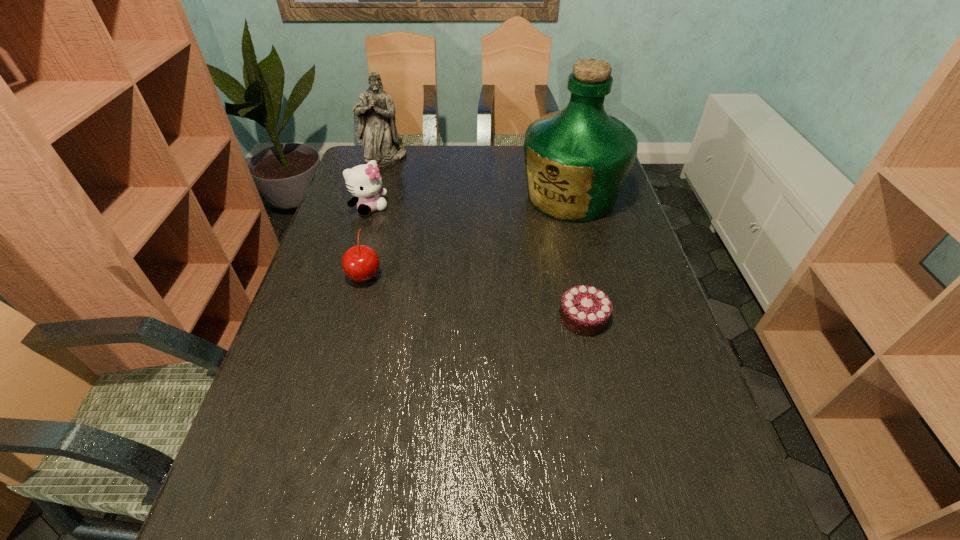
Locate an element on the screen. The height and width of the screenshot is (540, 960). vacant area that lies between the fourth shortest object and the fourth farthest object is located at coordinates (375, 216).

In order to click on free space between the liquor and the figurine in this screenshot , I will do `click(478, 177)`.

The height and width of the screenshot is (540, 960). I want to click on vacant area that lies between the cherry and the farthest object, so click(x=375, y=216).

In order to click on object identified as the third closest to the third tallest object in this screenshot , I will do `click(577, 160)`.

Locate which object is the closest to the chocolate cake. Please provide its 2D coordinates. Your answer should be formatted as a tuple, i.e. [(x, y)], where the tuple contains the x and y coordinates of a point satisfying the conditions above.

[(577, 160)]

Where is `free space that satisfies the following two spatial constraints: 1. on the back side of the tallest object; 2. on the left side of the third tallest object`? The height and width of the screenshot is (540, 960). free space that satisfies the following two spatial constraints: 1. on the back side of the tallest object; 2. on the left side of the third tallest object is located at coordinates (x=372, y=197).

The image size is (960, 540). In order to click on vacant space that satisfies the following two spatial constraints: 1. on the front side of the figurine; 2. on the right side of the liquor in this screenshot , I will do `click(373, 197)`.

Locate an element on the screen. The width and height of the screenshot is (960, 540). vacant area in the image that satisfies the following two spatial constraints: 1. on the front side of the second shortest object; 2. on the left side of the second tallest object is located at coordinates (350, 275).

Image resolution: width=960 pixels, height=540 pixels. Find the location of `vacant space that satisfies the following two spatial constraints: 1. on the back side of the tallest object; 2. on the right side of the kitten`. vacant space that satisfies the following two spatial constraints: 1. on the back side of the tallest object; 2. on the right side of the kitten is located at coordinates (372, 197).

Locate an element on the screen. free spot that satisfies the following two spatial constraints: 1. on the front side of the second tallest object; 2. on the right side of the second nearest object is located at coordinates (350, 275).